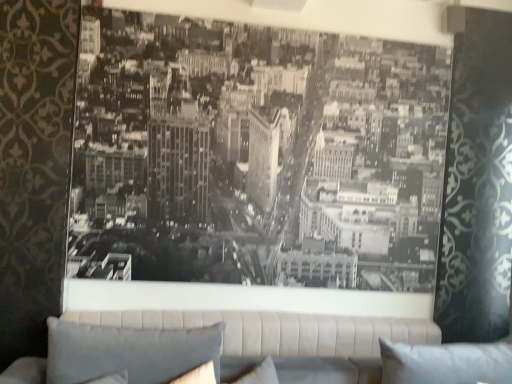
In order to click on white fabric pillow at lower right, which appears as the 1th pillow when viewed from the right in this screenshot , I will do `click(446, 363)`.

At what (x,y) coordinates should I click in order to perform the action: click on studio couch behind the white fabric pillow at lower right, which appears as the 1th pillow when viewed from the right. Please return your answer as a coordinate pair (x, y). The image size is (512, 384). Looking at the image, I should click on (261, 338).

How many degrees apart are the facing directions of white fabric pillow at lower right, which appears as the 1th pillow when viewed from the right, and beige fabric studio couch at center?

0.82 degrees.

Consider the image. Is white fabric pillow at lower right, which appears as the 1th pillow when viewed from the right, bigger or smaller than beige fabric studio couch at center?

Considering their sizes, white fabric pillow at lower right, which appears as the 1th pillow when viewed from the right, takes up less space than beige fabric studio couch at center.

Choose the correct answer: Is white fabric pillow at lower right, which appears as the 1th pillow when viewed from the right, inside beige fabric studio couch at center or outside it?

white fabric pillow at lower right, which appears as the 1th pillow when viewed from the right, is outside beige fabric studio couch at center.

Between beige fabric studio couch at center and gray fabric pillow at lower left, the 2th pillow when ordered from right to left, which one appears on the right side from the viewer's perspective?

From the viewer's perspective, beige fabric studio couch at center appears more on the right side.

From their relative heights in the image, would you say beige fabric studio couch at center is taller or shorter than gray fabric pillow at lower left, which is the first pillow from left to right?

beige fabric studio couch at center is shorter than gray fabric pillow at lower left, which is the first pillow from left to right.

Consider the image. From a real-world perspective, is beige fabric studio couch at center positioned above or below gray fabric pillow at lower left, the 2th pillow when ordered from right to left?

In terms of real-world spatial position, beige fabric studio couch at center is below gray fabric pillow at lower left, the 2th pillow when ordered from right to left.

From the picture: Considering the positions of objects gray fabric pillow at lower left, which is the first pillow from left to right, and white fabric pillow at lower right, which appears as the 1th pillow when viewed from the right, in the image provided, who is in front, gray fabric pillow at lower left, which is the first pillow from left to right, or white fabric pillow at lower right, which appears as the 1th pillow when viewed from the right,?

gray fabric pillow at lower left, which is the first pillow from left to right, is closer to the camera.

Can you tell me how much gray fabric pillow at lower left, which is the first pillow from left to right, and white fabric pillow at lower right, which is the second pillow from left to right, differ in facing direction?

0.000363 degrees separate the facing orientations of gray fabric pillow at lower left, which is the first pillow from left to right, and white fabric pillow at lower right, which is the second pillow from left to right.

Could you tell me if gray fabric pillow at lower left, the 2th pillow when ordered from right to left, is facing white fabric pillow at lower right, which is the second pillow from left to right?

No.

Does gray fabric pillow at lower left, the 2th pillow when ordered from right to left, have a greater height compared to white fabric pillow at lower right, which appears as the 1th pillow when viewed from the right?

Yes.

Considering the positions of objects beige fabric studio couch at center and white fabric pillow at lower right, which appears as the 1th pillow when viewed from the right, in the image provided, who is more to the right, beige fabric studio couch at center or white fabric pillow at lower right, which appears as the 1th pillow when viewed from the right,?

white fabric pillow at lower right, which appears as the 1th pillow when viewed from the right.

Between beige fabric studio couch at center and white fabric pillow at lower right, which appears as the 1th pillow when viewed from the right, which one has smaller size?

With smaller size is white fabric pillow at lower right, which appears as the 1th pillow when viewed from the right.

From the image's perspective, is beige fabric studio couch at center under white fabric pillow at lower right, which appears as the 1th pillow when viewed from the right?

Indeed, from the image's perspective, beige fabric studio couch at center is shown beneath white fabric pillow at lower right, which appears as the 1th pillow when viewed from the right.

Is white fabric pillow at lower right, which appears as the 1th pillow when viewed from the right, at the back of beige fabric studio couch at center?

No, beige fabric studio couch at center's orientation is not away from white fabric pillow at lower right, which appears as the 1th pillow when viewed from the right.

Which is less distant, (93, 359) or (312, 362)?

Point (93, 359) appears to be closer to the viewer than point (312, 362).

Is gray fabric pillow at lower left, the 2th pillow when ordered from right to left, facing away from beige fabric studio couch at center?

Yes.

Which object is closer to the camera taking this photo, gray fabric pillow at lower left, which is the first pillow from left to right, or beige fabric studio couch at center?

Positioned in front is gray fabric pillow at lower left, which is the first pillow from left to right.

Consider the image. Which of these two, gray fabric pillow at lower left, the 2th pillow when ordered from right to left, or beige fabric studio couch at center, is bigger?

→ With larger size is beige fabric studio couch at center.

Can you confirm if white fabric pillow at lower right, which is the second pillow from left to right, is shorter than gray fabric pillow at lower left, the 2th pillow when ordered from right to left?

Yes.

Could gray fabric pillow at lower left, which is the first pillow from left to right, be considered to be inside white fabric pillow at lower right, which is the second pillow from left to right?

No, gray fabric pillow at lower left, which is the first pillow from left to right, is not surrounded by white fabric pillow at lower right, which is the second pillow from left to right.

From the image's perspective, which is above, white fabric pillow at lower right, which appears as the 1th pillow when viewed from the right, or gray fabric pillow at lower left, which is the first pillow from left to right?

gray fabric pillow at lower left, which is the first pillow from left to right.

Locate an element on the screen. The image size is (512, 384). pillow below the gray fabric pillow at lower left, the 2th pillow when ordered from right to left (from the image's perspective) is located at coordinates (446, 363).

This screenshot has height=384, width=512. Find the location of `the 1st pillow in front of the beige fabric studio couch at center, starting your count from the anchor`. the 1st pillow in front of the beige fabric studio couch at center, starting your count from the anchor is located at coordinates (446, 363).

From a real-world perspective, which pillow is the 2nd one above the beige fabric studio couch at center? Please provide its 2D coordinates.

[(128, 351)]

Based on their spatial positions, is gray fabric pillow at lower left, which is the first pillow from left to right, or beige fabric studio couch at center further from white fabric pillow at lower right, which appears as the 1th pillow when viewed from the right?

gray fabric pillow at lower left, which is the first pillow from left to right.

Based on their spatial positions, is white fabric pillow at lower right, which is the second pillow from left to right, or beige fabric studio couch at center closer to gray fabric pillow at lower left, which is the first pillow from left to right?

beige fabric studio couch at center lies closer to gray fabric pillow at lower left, which is the first pillow from left to right, than the other object.

From the picture: Estimate the real-world distances between objects in this image. Which object is closer to gray fabric pillow at lower left, which is the first pillow from left to right, beige fabric studio couch at center or white fabric pillow at lower right, which is the second pillow from left to right?

Among the two, beige fabric studio couch at center is located nearer to gray fabric pillow at lower left, which is the first pillow from left to right.

When comparing their distances from white fabric pillow at lower right, which appears as the 1th pillow when viewed from the right, does beige fabric studio couch at center or gray fabric pillow at lower left, which is the first pillow from left to right, seem further?

The object further to white fabric pillow at lower right, which appears as the 1th pillow when viewed from the right, is gray fabric pillow at lower left, which is the first pillow from left to right.

Which object lies further to the anchor point beige fabric studio couch at center, gray fabric pillow at lower left, the 2th pillow when ordered from right to left, or white fabric pillow at lower right, which is the second pillow from left to right?

gray fabric pillow at lower left, the 2th pillow when ordered from right to left.

Considering their positions, is white fabric pillow at lower right, which is the second pillow from left to right, positioned further to beige fabric studio couch at center than gray fabric pillow at lower left, which is the first pillow from left to right?

gray fabric pillow at lower left, which is the first pillow from left to right, is positioned further to the anchor beige fabric studio couch at center.

Locate an element on the screen. studio couch between gray fabric pillow at lower left, the 2th pillow when ordered from right to left, and white fabric pillow at lower right, which appears as the 1th pillow when viewed from the right, in the horizontal direction is located at coordinates (261, 338).